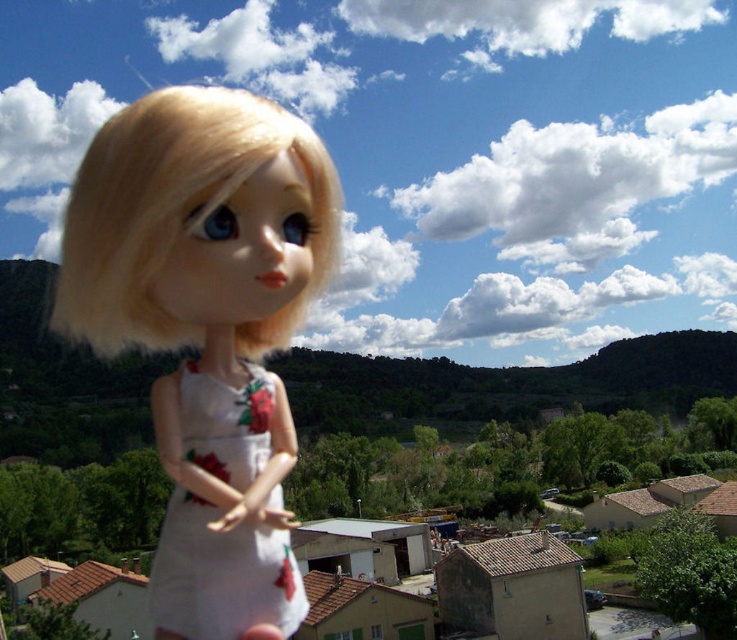
You are a child who wants to dress the satin white doll at center with the white matte dress at left. Based on the size of the doll and the dress, will the dress fit properly?

The satin white doll at center is larger in size than the white matte dress at left, so the dress may be too small to fit the doll properly.

You are a toy store employee arranging dolls on a shelf. You have a satin white doll at center and a white matte dress at left. Which object should you place higher on the shelf to ensure proper visibility?

The satin white doll at center is much taller than the white matte dress at left, so you should place the satin white doll at center higher on the shelf to ensure proper visibility.